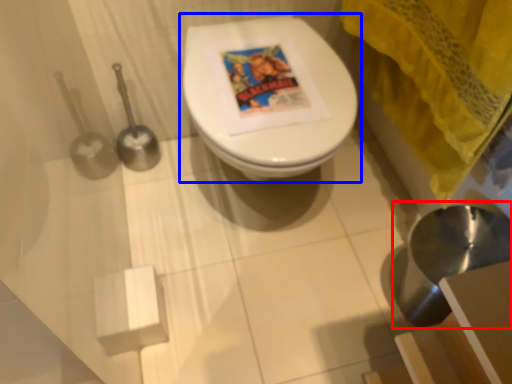
Question: Which of the following is the farthest to the observer, sink (highlighted by a red box) or toilet (highlighted by a blue box)?

Choices:
 (A) sink
 (B) toilet

Answer: (B)